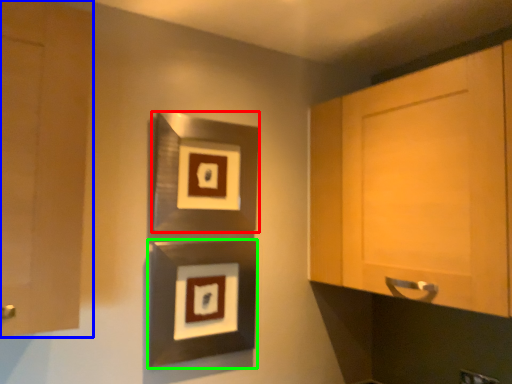
Question: Which object is positioned farthest from picture frame (highlighted by a red box)? Select from cabinetry (highlighted by a blue box) and picture frame (highlighted by a green box).

Choices:
 (A) cabinetry
 (B) picture frame

Answer: (A)